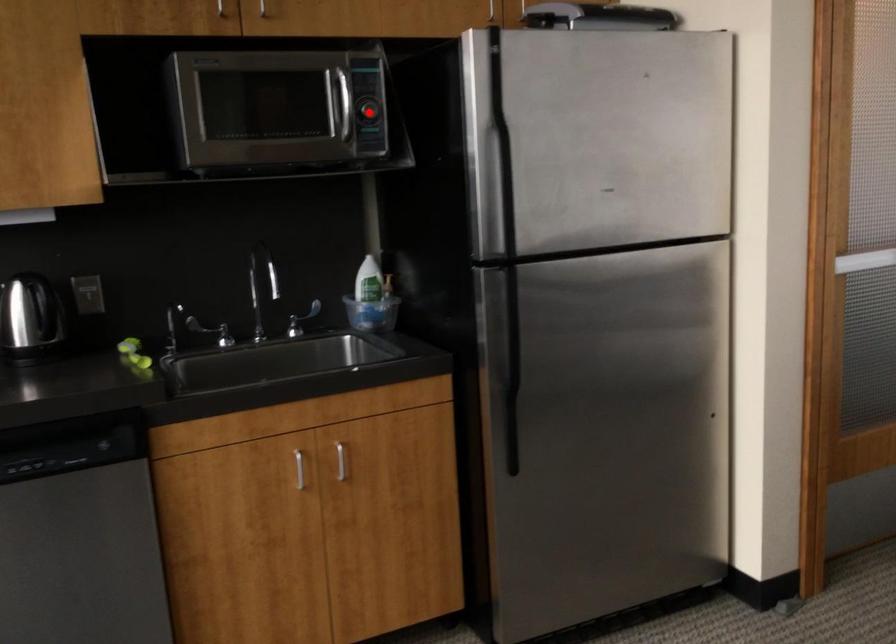
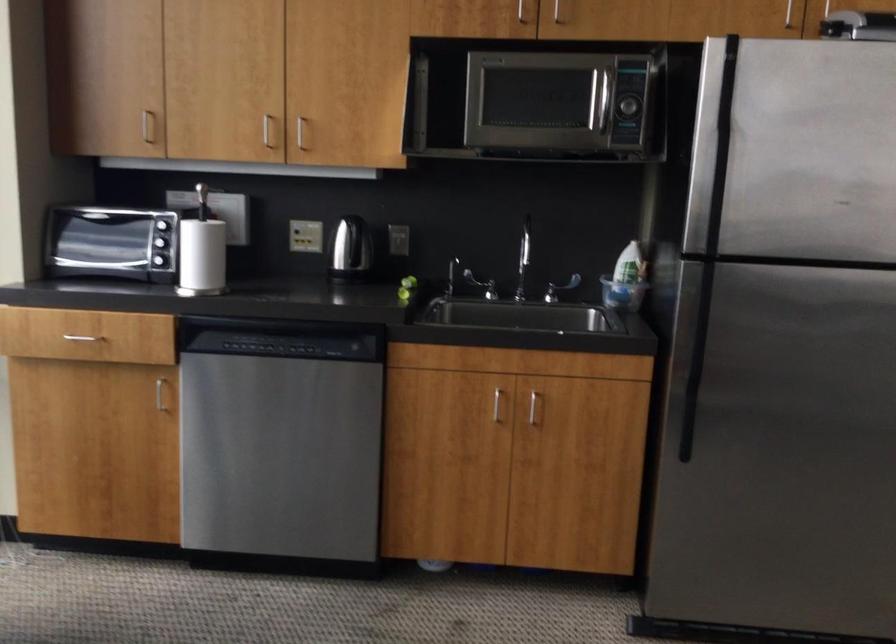
Locate, in the second image, the point that corresponds to the highlighted location in the first image.

(626, 106)